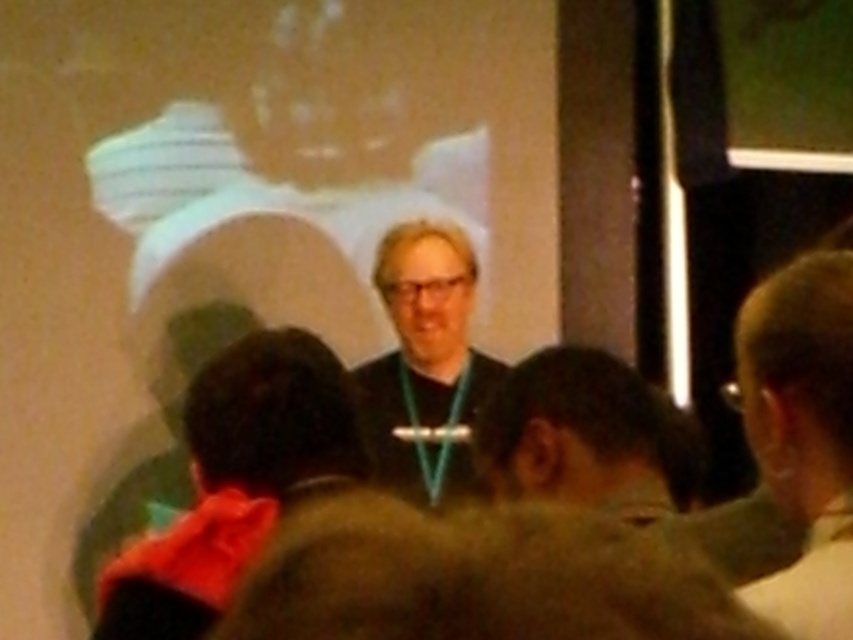
Question: Is dark brown hair at center to the left of matte black shirt at center from the viewer's perspective?

Choices:
 (A) no
 (B) yes

Answer: (A)

Question: Can you confirm if dark brown hair at center is smaller than matte black shirt at center?

Choices:
 (A) yes
 (B) no

Answer: (A)

Question: Can you confirm if dark brown hair at center is positioned below matte black shirt at center?

Choices:
 (A) yes
 (B) no

Answer: (A)

Question: Which point is farther to the camera?

Choices:
 (A) matte black shirt at center
 (B) dark brown hair at center

Answer: (A)

Question: Which object is farther from the camera taking this photo?

Choices:
 (A) dark brown hair at center
 (B) matte black shirt at center

Answer: (B)